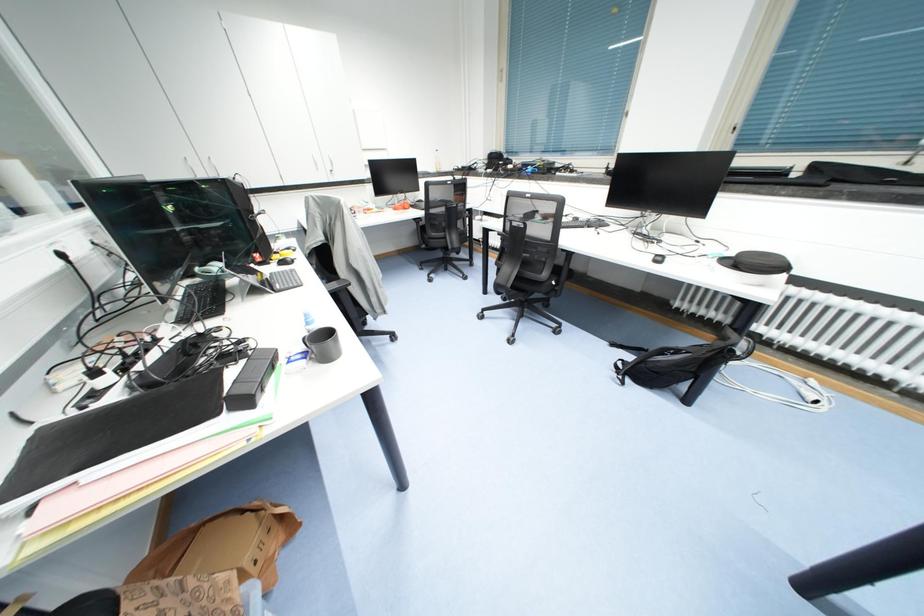
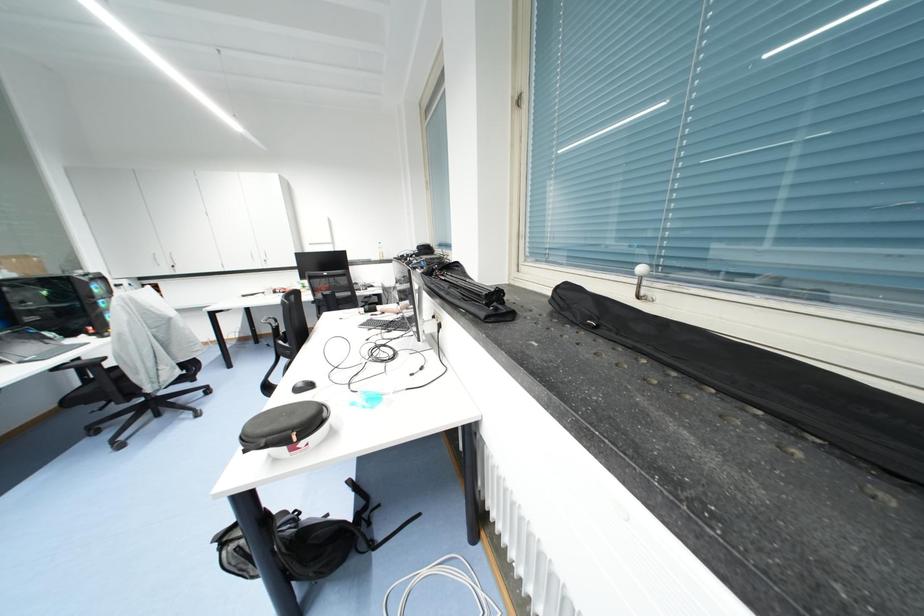
Question: What movement of the cameraman would produce the second image?

Choices:
 (A) Left
 (B) Right
 (C) Forward
 (D) Backward

Answer: (B)